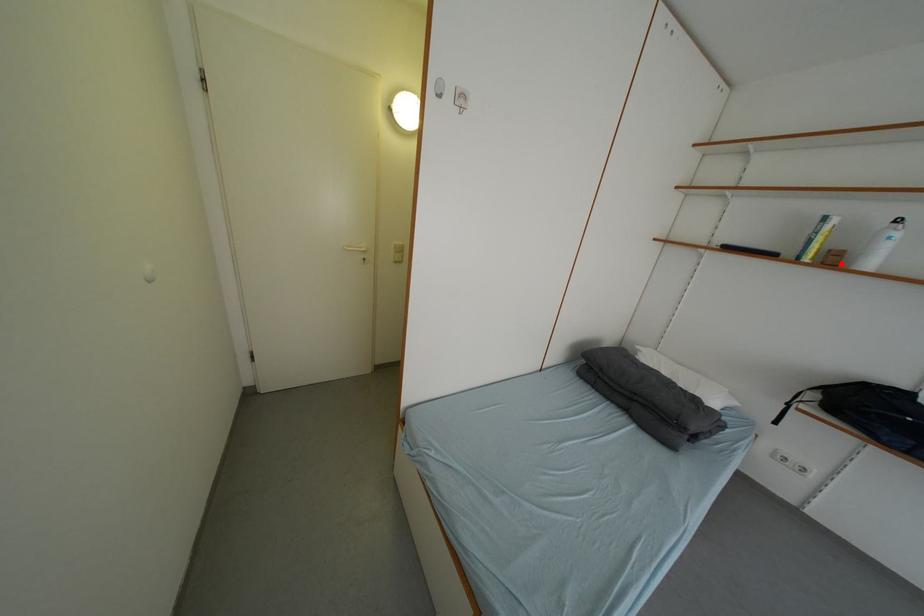
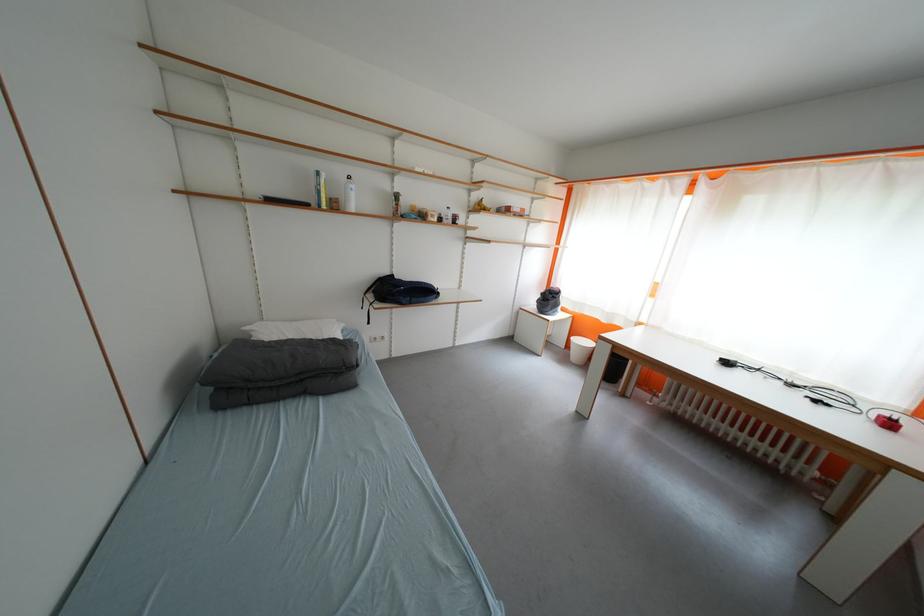
Question: I am providing you with two images of the same scene from different viewpoints. Image1 has a red point marked. In image2, the corresponding 3D location appears at what relative position? Reply with the corresponding letter.

Choices:
 (A) Closer
 (B) Farther

Answer: (A)